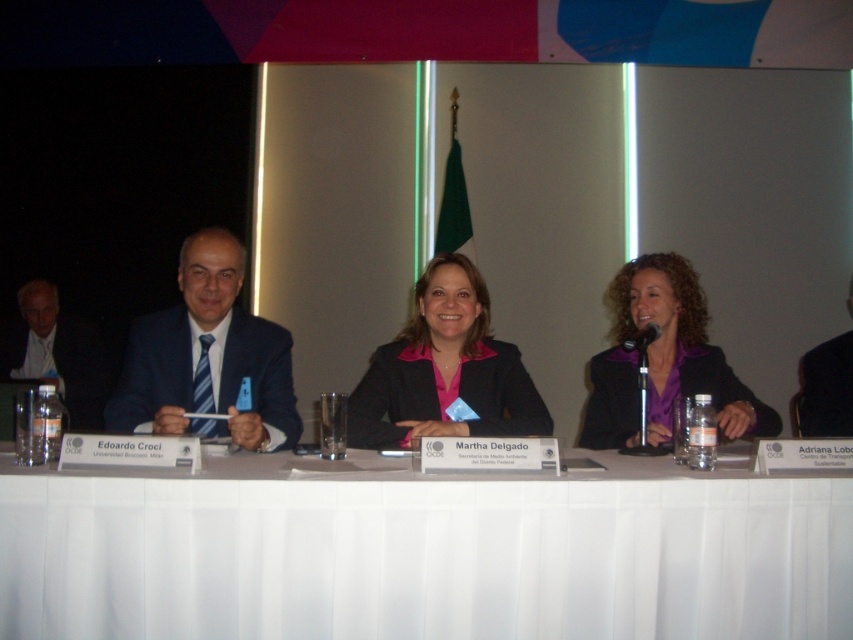
Question: Is matte black blazer at center bigger than dark blue suit at left?

Choices:
 (A) no
 (B) yes

Answer: (A)

Question: Estimate the real-world distances between objects in this image. Which object is closer to the matte black blazer at center?

Choices:
 (A) black fabric suit at right
 (B) white fabric table at center
 (C) purple matte blazer at center

Answer: (C)

Question: Which point is closer to the camera?

Choices:
 (A) dark blue suit at left
 (B) white fabric table at center

Answer: (B)

Question: Can you confirm if blue striped tie at left is smaller than black fabric suit at right?

Choices:
 (A) yes
 (B) no

Answer: (B)

Question: Observing the image, what is the correct spatial positioning of blue striped tie at left in reference to purple matte blazer at center?

Choices:
 (A) below
 (B) above

Answer: (A)

Question: Among these points, which one is nearest to the camera?

Choices:
 (A) [645, 276]
 (B) [844, 365]
 (C) [51, 342]

Answer: (A)